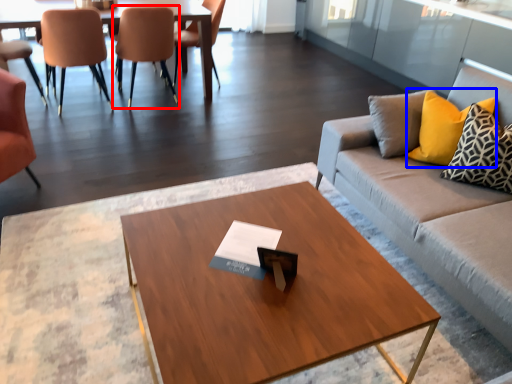
Question: Which of the following is the closest to the observer, chair (highlighted by a red box) or pillow (highlighted by a blue box)?

Choices:
 (A) chair
 (B) pillow

Answer: (B)